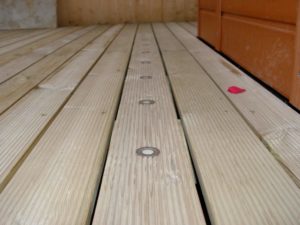
The width and height of the screenshot is (300, 225). What are the coordinates of `lines seperating floorboard` in the screenshot? It's located at (200, 191), (280, 167), (102, 181), (34, 145), (20, 100), (11, 73), (12, 60), (13, 49), (10, 40), (10, 33).